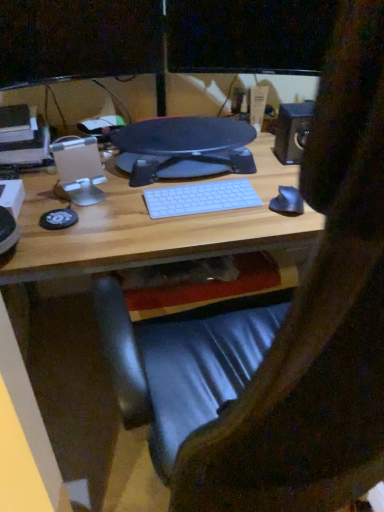
Find the location of a particular element. The height and width of the screenshot is (512, 384). free point above white matte keyboard at center (from a real-world perspective) is located at coordinates pyautogui.click(x=199, y=193).